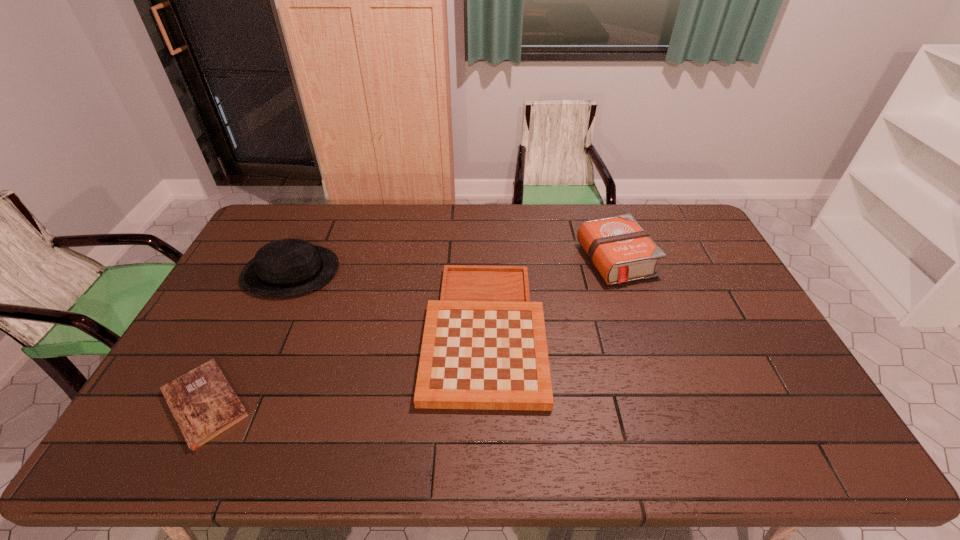
Where is `free space located on the back of the shorter Bible`? The width and height of the screenshot is (960, 540). free space located on the back of the shorter Bible is located at coordinates (259, 298).

I want to click on object situated at the far edge, so click(618, 247).

This screenshot has height=540, width=960. Identify the location of object that is at the near edge. (204, 405).

Where is `fedora at the left edge`? fedora at the left edge is located at coordinates (288, 267).

Image resolution: width=960 pixels, height=540 pixels. I want to click on Bible present at the left edge, so click(204, 405).

This screenshot has height=540, width=960. Find the location of `object that is at the near left corner`. object that is at the near left corner is located at coordinates (204, 405).

You are a GUI agent. You are given a task and a screenshot of the screen. Output one action in this format:
    pyautogui.click(x=<x>, y=<y>)
    Task: Click on the vacant space at the far edge of the desktop
    Image resolution: width=960 pixels, height=540 pixels.
    Given the screenshot: What is the action you would take?
    pyautogui.click(x=322, y=232)

Image resolution: width=960 pixels, height=540 pixels. I want to click on vacant space at the near edge of the desktop, so click(568, 430).

The height and width of the screenshot is (540, 960). What are the coordinates of `vacant space at the far left corner of the desktop` in the screenshot? It's located at (266, 221).

Identify the location of blank area at the far right corner. (665, 212).